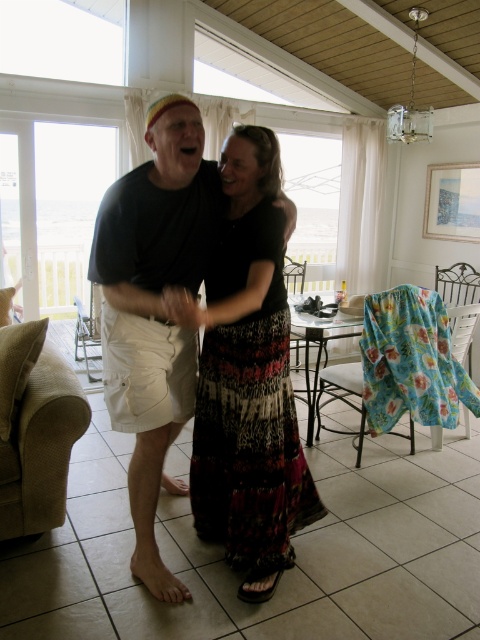
Question: Which object is positioned farthest from the beige fabric armchair at lower left?

Choices:
 (A) printed fabric dress at center
 (B) matte black t-shirt at center
 (C) white fabric armchair at left

Answer: (C)

Question: Among these objects, which one is farthest from the camera?

Choices:
 (A) matte black t-shirt at center
 (B) white fabric armchair at left
 (C) beige fabric armchair at lower left
 (D) printed fabric dress at center

Answer: (B)

Question: Estimate the real-world distances between objects in this image. Which object is closer to the printed fabric dress at center?

Choices:
 (A) matte black t-shirt at center
 (B) white fabric armchair at left
 (C) beige fabric armchair at lower left

Answer: (A)

Question: Is printed fabric dress at center closer to camera compared to beige fabric armchair at lower left?

Choices:
 (A) yes
 (B) no

Answer: (A)

Question: Can you confirm if matte black t-shirt at center is positioned to the left of white fabric armchair at left?

Choices:
 (A) no
 (B) yes

Answer: (A)

Question: Does matte black t-shirt at center appear over white fabric armchair at left?

Choices:
 (A) yes
 (B) no

Answer: (B)